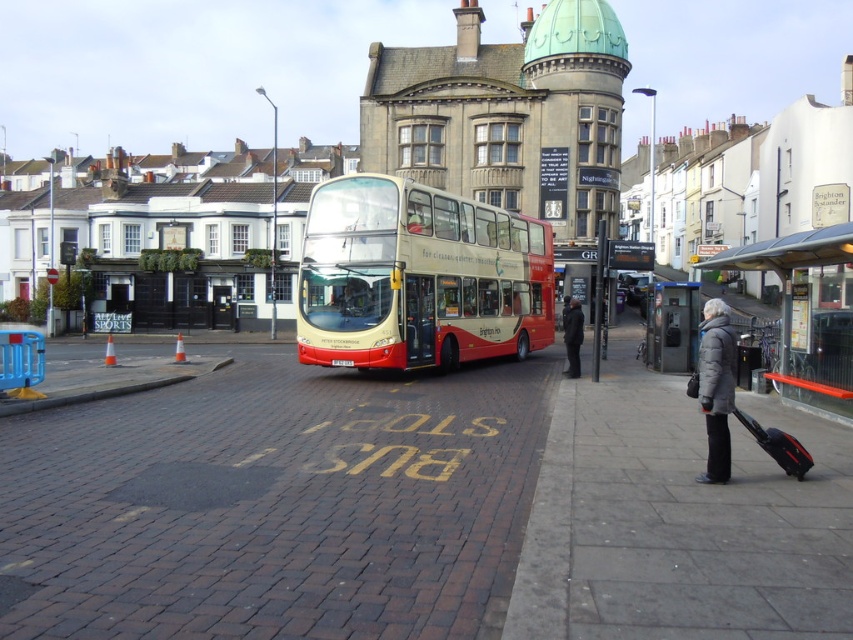
Is matte cream double-decker bus at center in front of metallic gray bus stop at center?

Yes, it is in front of metallic gray bus stop at center.

Which is behind, point (482, 259) or point (676, 305)?

The point (482, 259) is behind.

Find the location of a particular element. matte cream double-decker bus at center is located at coordinates (418, 276).

Locate an element on the screen. metallic gray bus stop at center is located at coordinates (672, 326).

Is point (647, 356) behind point (567, 365)?

Yes.

The height and width of the screenshot is (640, 853). Identify the location of metallic gray bus stop at center. (672, 326).

Who is more distant from viewer, (225, 493) or (584, 461)?

The point (584, 461) is more distant.

Does brick pavement at center lie behind gray concrete sidewalk at lower right?

That is True.

Is point (79, 416) positioned before point (532, 531)?

No.

Identify the location of brick pavement at center. (274, 504).